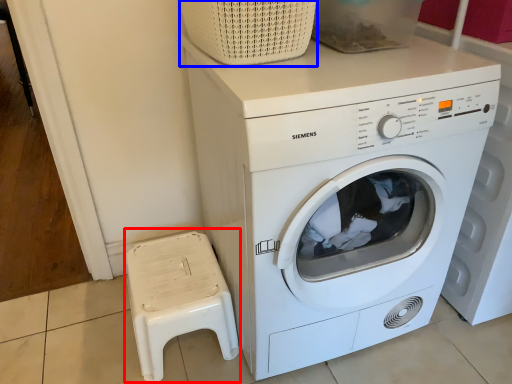
Question: Which object is further to the camera taking this photo, music stool (highlighted by a red box) or basket (highlighted by a blue box)?

Choices:
 (A) music stool
 (B) basket

Answer: (A)